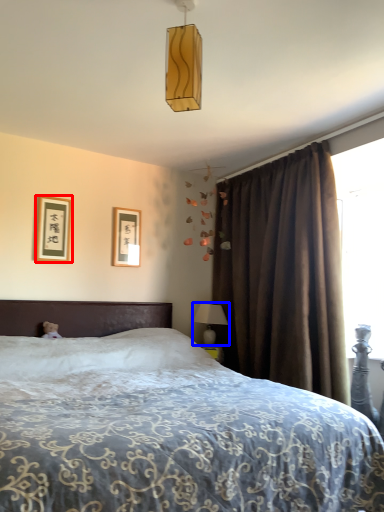
Question: Which of the following is the farthest to the observer, picture frame (highlighted by a red box) or table lamp (highlighted by a blue box)?

Choices:
 (A) picture frame
 (B) table lamp

Answer: (B)